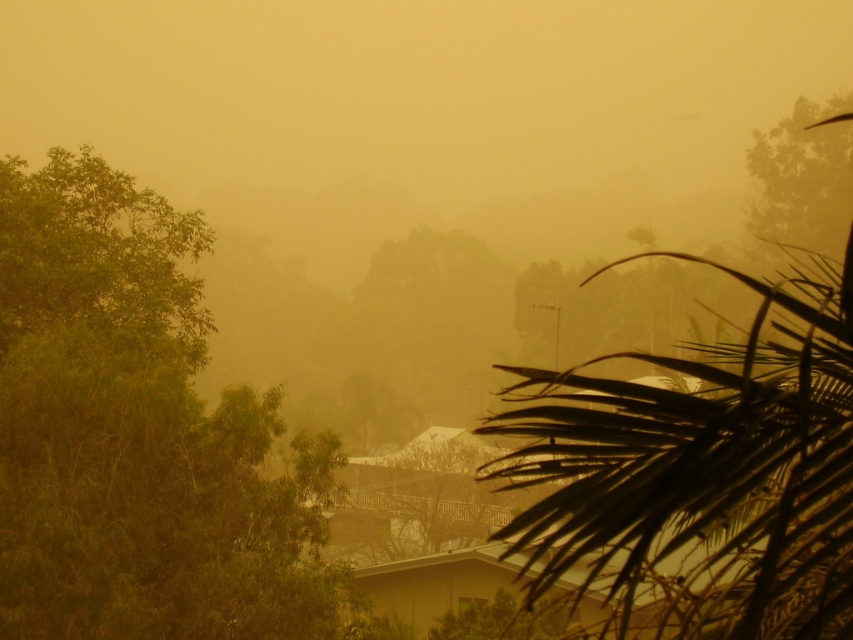
You are standing in the hazy scene and want to walk from the green leafy tree at left to the dark green leafy palm tree at right. Which direction should you face to move directly towards it?

You should face to the right because the dark green leafy palm tree at right is to the right of the green leafy tree at left.

Based on the scene description, which tree is taller between the green leafy tree at left and the dark green leafy palm tree at right?

The dark green leafy palm tree at right is taller than the green leafy tree at left according to the description.